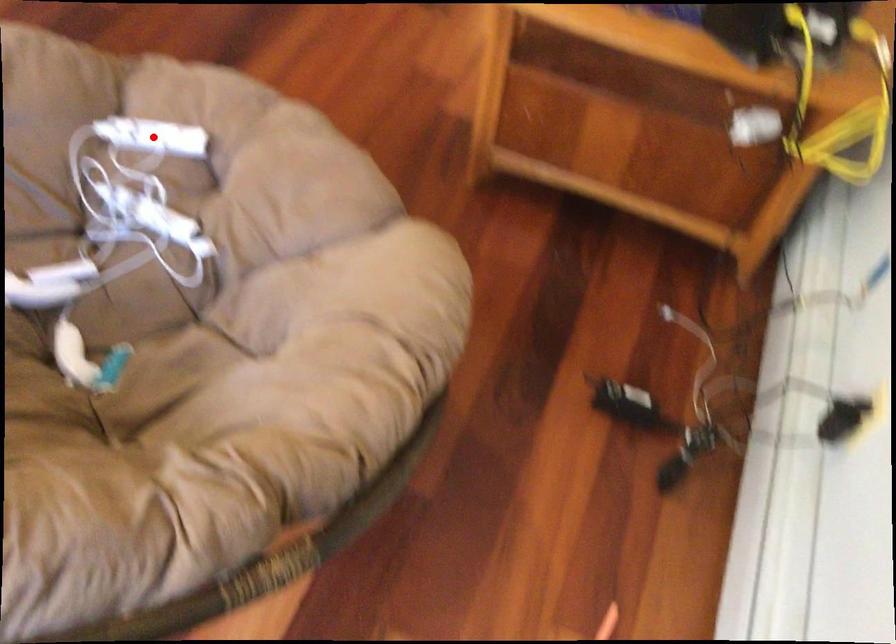
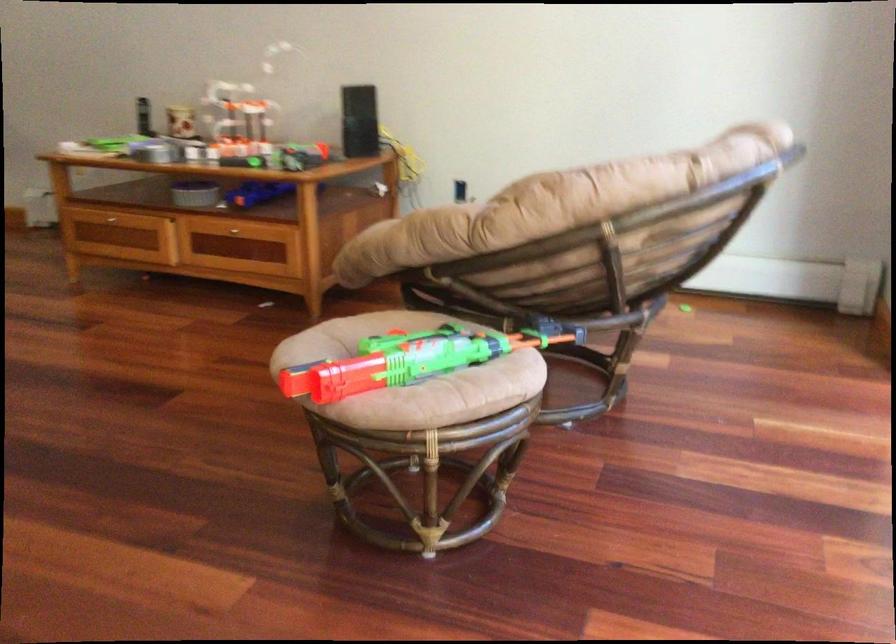
Question: I am providing you with two images of the same scene from different viewpoints. A red point is marked on the first image. At the location where the point appears in image 1, is it still visible in image 2?

Choices:
 (A) Yes
 (B) No

Answer: (B)